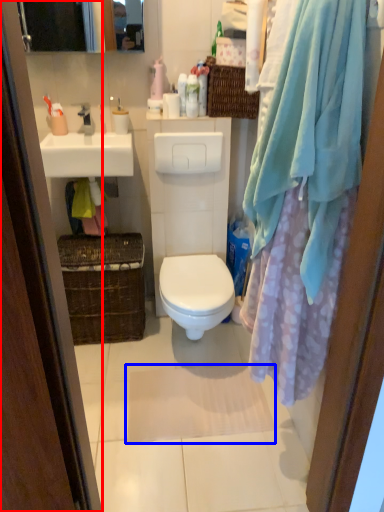
Question: Which object appears farthest to the camera in this image, screen door (highlighted by a red box) or bath mat (highlighted by a blue box)?

Choices:
 (A) screen door
 (B) bath mat

Answer: (B)